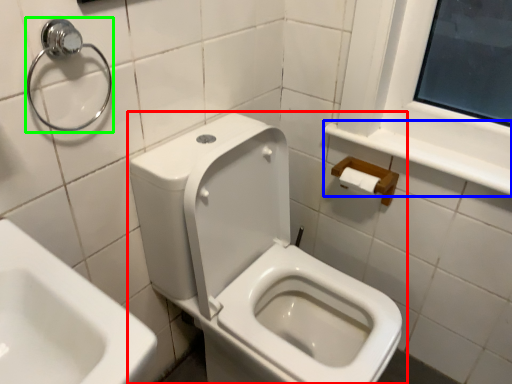
Question: Which object is the closest to the toilet (highlighted by a red box)? Choose among these: balustrade (highlighted by a blue box) or shower (highlighted by a green box).

Choices:
 (A) balustrade
 (B) shower

Answer: (A)